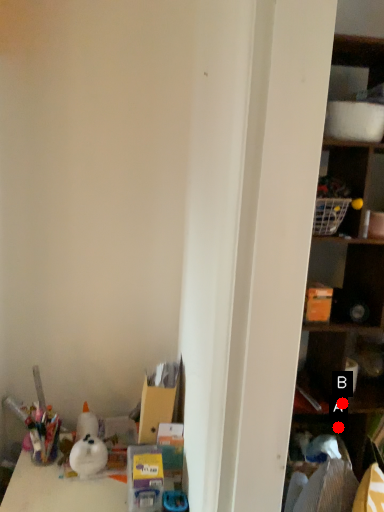
Question: Two points are circled on the image, labeled by A and B beside each circle. Among these points, which one is farthest from the camera?

Choices:
 (A) A is further
 (B) B is further

Answer: (A)